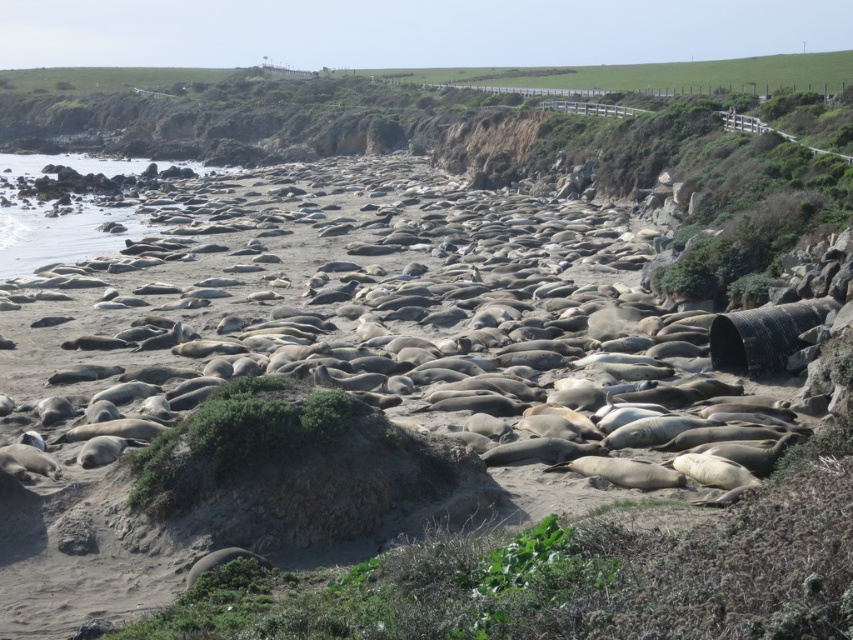
Can you confirm if gray matte seal at center is bigger than gray matte seal at lower left?

Indeed, gray matte seal at center has a larger size compared to gray matte seal at lower left.

Is gray matte seal at center below gray matte seal at lower left?

Incorrect, gray matte seal at center is not positioned below gray matte seal at lower left.

Does point (461, 451) lie behind point (196, 576)?

That is True.

Identify the location of gray matte seal at center. (370, 360).